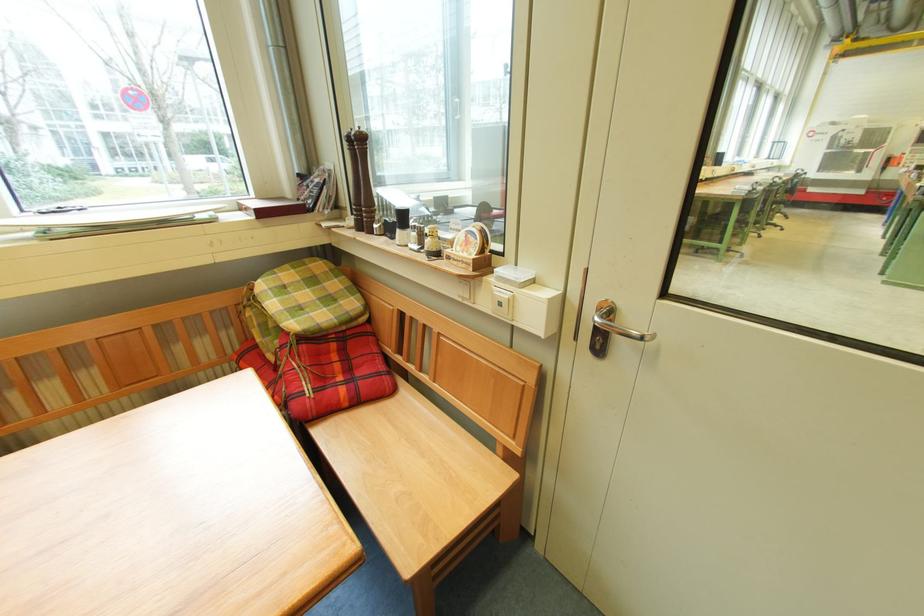
Find the location of a particular element. white light switch is located at coordinates (502, 302).